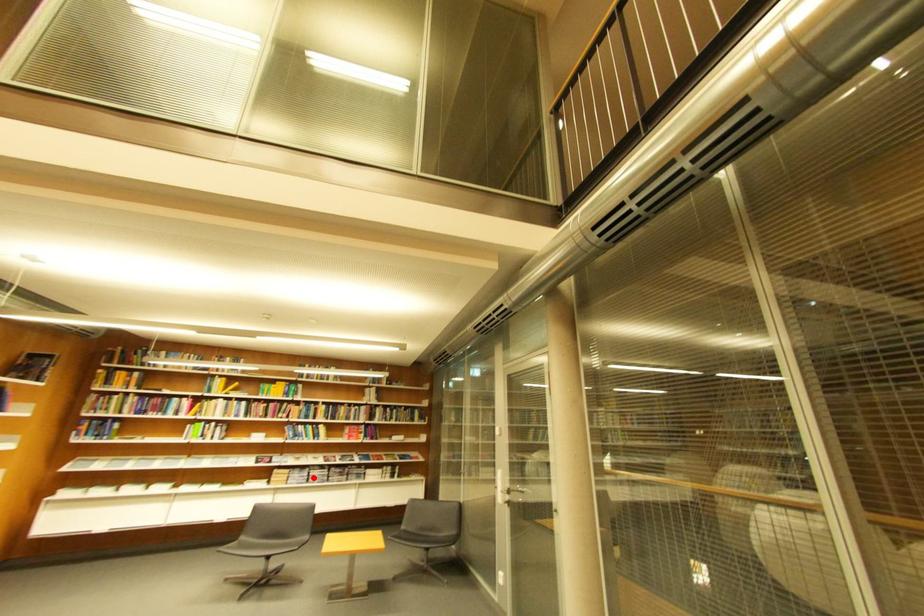
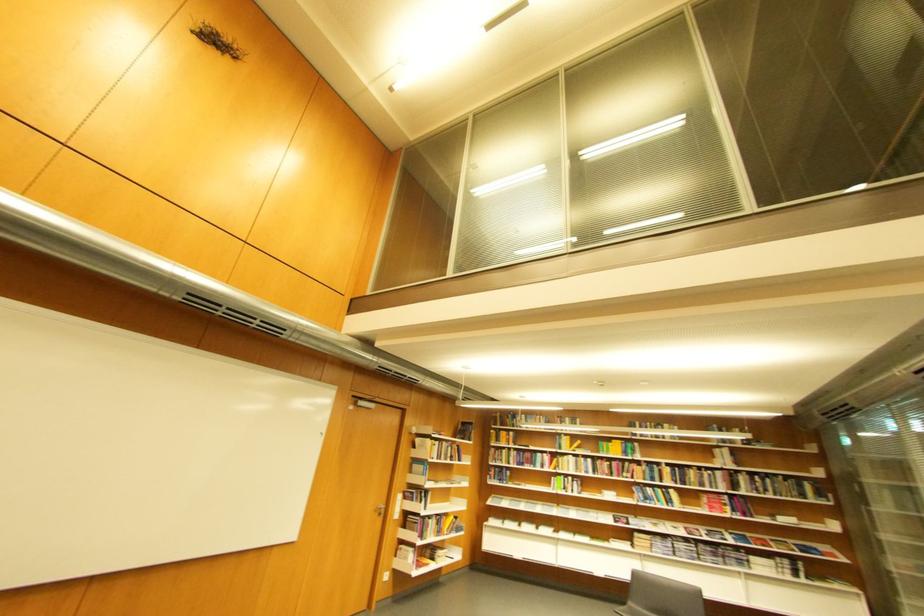
In the second image, find the point that corresponds to the highlighted location in the first image.

(677, 549)